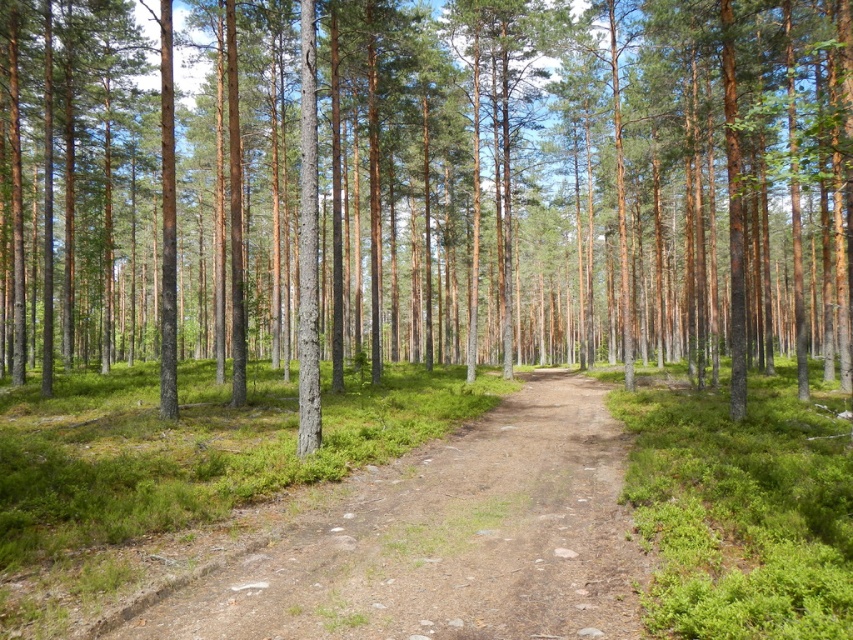
Question: Is brown bark tree at center wider than brown dirt track at center?

Choices:
 (A) no
 (B) yes

Answer: (B)

Question: Is brown bark tree at center further to the viewer compared to brown dirt track at center?

Choices:
 (A) no
 (B) yes

Answer: (B)

Question: Which point is farther from the camera taking this photo?

Choices:
 (A) (554, 440)
 (B) (664, 74)

Answer: (B)

Question: Does brown bark tree at center have a smaller size compared to brown dirt track at center?

Choices:
 (A) yes
 (B) no

Answer: (B)